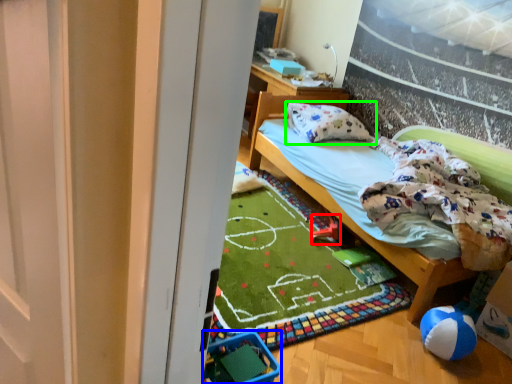
Question: Considering the real-world distances, which object is farthest from toy (highlighted by a red box)? baby carriage (highlighted by a blue box) or pillow (highlighted by a green box)?

Choices:
 (A) baby carriage
 (B) pillow

Answer: (A)